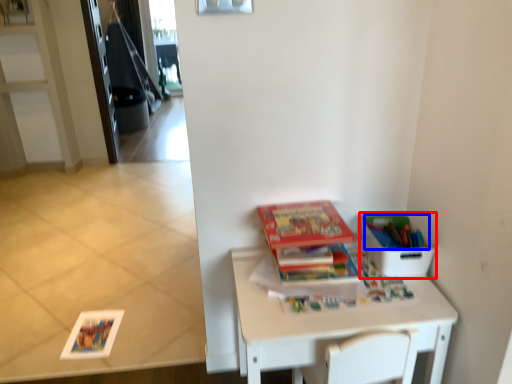
Question: Which object appears closest to the camera in this image, cardboard box (highlighted by a red box) or book (highlighted by a blue box)?

Choices:
 (A) cardboard box
 (B) book

Answer: (A)